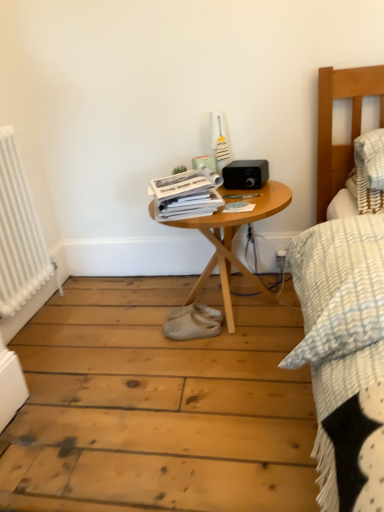
What is the approximate width of white glossy magazine at center, arranged as the first magazine when viewed from the left?

32.10 centimeters.

The width and height of the screenshot is (384, 512). I want to click on matte paper magazine at center, which ranks as the 2th magazine in left-to-right order, so click(238, 207).

What do you see at coordinates (283, 261) in the screenshot? I see `white plastic electric outlet at lower right` at bounding box center [283, 261].

Find the location of a particular element. white glossy magazine at center, arranged as the first magazine when viewed from the left is located at coordinates (186, 195).

Is white glossy magazine at center, arranged as the first magazine when viewed from the left, inside the boundaries of matte paper magazine at center, which is counted as the 1th magazine, starting from the right, or outside?

white glossy magazine at center, arranged as the first magazine when viewed from the left, cannot be found inside matte paper magazine at center, which is counted as the 1th magazine, starting from the right.

Visually, is white glossy magazine at center, arranged as the first magazine when viewed from the left, positioned to the left or to the right of matte paper magazine at center, which is counted as the 1th magazine, starting from the right?

Clearly, white glossy magazine at center, arranged as the first magazine when viewed from the left, is on the left of matte paper magazine at center, which is counted as the 1th magazine, starting from the right, in the image.

Is white glossy magazine at center, arranged as the first magazine when viewed from the left, next to matte paper magazine at center, which is counted as the 1th magazine, starting from the right?

No, white glossy magazine at center, arranged as the first magazine when viewed from the left, is not with matte paper magazine at center, which is counted as the 1th magazine, starting from the right.

From the image's perspective, between white glossy magazine at center, arranged as the first magazine when viewed from the left, and matte paper magazine at center, which is counted as the 1th magazine, starting from the right, who is located below?

matte paper magazine at center, which is counted as the 1th magazine, starting from the right, is shown below in the image.

Measure the distance from white suede shoe at center to white glossy magazine at center, which ranks as the second magazine in right-to-left order.

white suede shoe at center and white glossy magazine at center, which ranks as the second magazine in right-to-left order, are 21.62 inches apart.

Looking at this image, between white suede shoe at center and white glossy magazine at center, arranged as the first magazine when viewed from the left, which one has less height?

Standing shorter between the two is white suede shoe at center.

Which object is more forward, white suede shoe at center or white glossy magazine at center, which ranks as the second magazine in right-to-left order?

Positioned in front is white glossy magazine at center, which ranks as the second magazine in right-to-left order.

Considering the relative sizes of white glossy magazine at center, arranged as the first magazine when viewed from the left, and white metallic radiator at left in the image provided, is white glossy magazine at center, arranged as the first magazine when viewed from the left, wider than white metallic radiator at left?

Yes, white glossy magazine at center, arranged as the first magazine when viewed from the left, is wider than white metallic radiator at left.

Which object is more forward, white glossy magazine at center, arranged as the first magazine when viewed from the left, or white metallic radiator at left?

white metallic radiator at left.

Is white glossy magazine at center, arranged as the first magazine when viewed from the left, beside white metallic radiator at left?

There is a gap between white glossy magazine at center, arranged as the first magazine when viewed from the left, and white metallic radiator at left.

Identify the location of radiator below the white glossy magazine at center, arranged as the first magazine when viewed from the left (from a real-world perspective). (19, 234).

Does point (194, 298) come in front of point (16, 308)?

No.

Which of these two, woodenobject at center or white metallic radiator at left, stands taller?

Standing taller between the two is white metallic radiator at left.

Is woodenobject at center to the right of white metallic radiator at left from the viewer's perspective?

Yes.

From the image's perspective, between woodenobject at center and white metallic radiator at left, which one is located above?

white metallic radiator at left.

Which object is thinner, white glossy magazine at center, which ranks as the second magazine in right-to-left order, or woodenobject at center?

Thinner between the two is white glossy magazine at center, which ranks as the second magazine in right-to-left order.

Would you say white glossy magazine at center, which ranks as the second magazine in right-to-left order, is outside woodenobject at center?

Yes, white glossy magazine at center, which ranks as the second magazine in right-to-left order, is outside of woodenobject at center.

Is woodenobject at center at the back of white glossy magazine at center, which ranks as the second magazine in right-to-left order?

That's not correct — white glossy magazine at center, which ranks as the second magazine in right-to-left order, is not looking away from woodenobject at center.

From a real-world perspective, is white glossy magazine at center, arranged as the first magazine when viewed from the left, positioned above or below woodenobject at center?

Clearly, from a real-world perspective, white glossy magazine at center, arranged as the first magazine when viewed from the left, is above woodenobject at center.

Which point is more forward, (222, 199) or (169, 337)?

The point (222, 199) is more forward.

Measure the distance from white glossy magazine at center, which ranks as the second magazine in right-to-left order, to white suede shoe at center.

white glossy magazine at center, which ranks as the second magazine in right-to-left order, and white suede shoe at center are 54.90 centimeters apart from each other.

Is white glossy magazine at center, which ranks as the second magazine in right-to-left order, oriented away from white suede shoe at center?

No, white suede shoe at center is not at the back of white glossy magazine at center, which ranks as the second magazine in right-to-left order.

Which of these two, white suede shoe at center or white plastic electric outlet at lower right, stands shorter?

white plastic electric outlet at lower right is shorter.

From a real-world perspective, between white suede shoe at center and white plastic electric outlet at lower right, who is vertically lower?

white suede shoe at center.

Could you tell me if white suede shoe at center is turned towards white plastic electric outlet at lower right?

No, white suede shoe at center is not facing towards white plastic electric outlet at lower right.

Which is nearer, (190, 318) or (278, 259)?

Positioned in front is point (190, 318).

Locate an element on the screen. The width and height of the screenshot is (384, 512). magazine below the white glossy magazine at center, arranged as the first magazine when viewed from the left (from the image's perspective) is located at coordinates (238, 207).

This screenshot has width=384, height=512. I want to click on the 2nd magazine positioned above the white suede shoe at center (from a real-world perspective), so click(x=186, y=195).

When comparing their distances from white glossy magazine at center, arranged as the first magazine when viewed from the left, does woodenobject at center or white suede shoe at center seem closer?

woodenobject at center is positioned closer to the anchor white glossy magazine at center, arranged as the first magazine when viewed from the left.

Estimate the real-world distances between objects in this image. Which object is closer to white plastic electric outlet at lower right, white glossy magazine at center, arranged as the first magazine when viewed from the left, or woodenobject at center?

woodenobject at center is closer to white plastic electric outlet at lower right.

Based on their spatial positions, is white glossy magazine at center, arranged as the first magazine when viewed from the left, or white metallic radiator at left closer to white suede shoe at center?

Among the two, white glossy magazine at center, arranged as the first magazine when viewed from the left, is located nearer to white suede shoe at center.

Looking at the image, which one is located closer to white metallic radiator at left, matte paper magazine at center, which is counted as the 1th magazine, starting from the right, or white plastic electric outlet at lower right?

matte paper magazine at center, which is counted as the 1th magazine, starting from the right, lies closer to white metallic radiator at left than the other object.

Which object lies nearer to the anchor point matte paper magazine at center, which is counted as the 1th magazine, starting from the right, white suede shoe at center or white plastic electric outlet at lower right?

Based on the image, white suede shoe at center appears to be nearer to matte paper magazine at center, which is counted as the 1th magazine, starting from the right.

Estimate the real-world distances between objects in this image. Which object is closer to white plastic electric outlet at lower right, white metallic radiator at left or white suede shoe at center?

Among the two, white suede shoe at center is located nearer to white plastic electric outlet at lower right.

Considering their positions, is white plastic electric outlet at lower right positioned closer to white suede shoe at center than white glossy magazine at center, which ranks as the second magazine in right-to-left order?

Among the two, white glossy magazine at center, which ranks as the second magazine in right-to-left order, is located nearer to white suede shoe at center.

Looking at this image, when comparing their distances from white metallic radiator at left, does white suede shoe at center or white glossy magazine at center, arranged as the first magazine when viewed from the left, seem closer?

Among the two, white glossy magazine at center, arranged as the first magazine when viewed from the left, is located nearer to white metallic radiator at left.

Identify the location of table that lies between matte paper magazine at center, which ranks as the 2th magazine in left-to-right order, and white suede shoe at center from top to bottom. (232, 239).

You are a GUI agent. You are given a task and a screenshot of the screen. Output one action in this format:
    pyautogui.click(x=<x>, y=<y>)
    Task: Click on the magazine between white glossy magazine at center, arranged as the first magazine when viewed from the left, and woodenobject at center, in the vertical direction
    The width and height of the screenshot is (384, 512).
    Given the screenshot: What is the action you would take?
    pyautogui.click(x=238, y=207)

In order to click on footwear between white metallic radiator at left and matte paper magazine at center, which is counted as the 1th magazine, starting from the right, from left to right in this screenshot , I will do click(x=191, y=327).

I want to click on footwear located between white metallic radiator at left and woodenobject at center in the left-right direction, so click(191, 327).